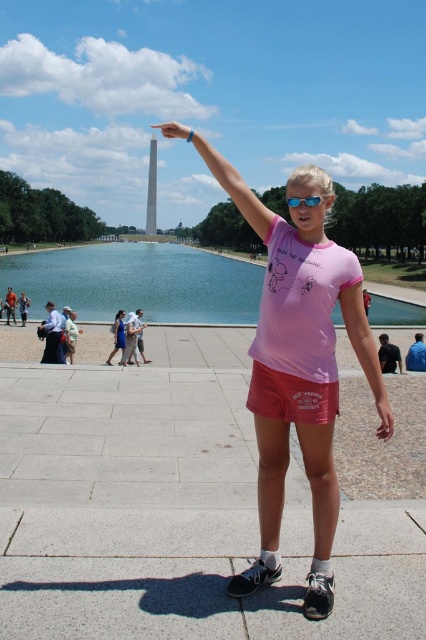
Question: Is pink cotton shorts at center wider than matte silver monument at upper center?

Choices:
 (A) no
 (B) yes

Answer: (A)

Question: Among these points, which one is nearest to the camera?

Choices:
 (A) (167, 129)
 (B) (187, 262)

Answer: (A)

Question: Does pink matte t-shirt at center appear under clear water at center?

Choices:
 (A) yes
 (B) no

Answer: (A)

Question: Considering the relative positions of pink cotton shorts at center and matte silver monument at upper center in the image provided, where is pink cotton shorts at center located with respect to matte silver monument at upper center?

Choices:
 (A) above
 (B) below

Answer: (B)

Question: Which point appears closest to the camera in this image?

Choices:
 (A) (253, 284)
 (B) (112, 332)
 (C) (279, 376)

Answer: (C)

Question: Which of the following is the closest to the observer?

Choices:
 (A) (367, 369)
 (B) (267, 372)

Answer: (A)